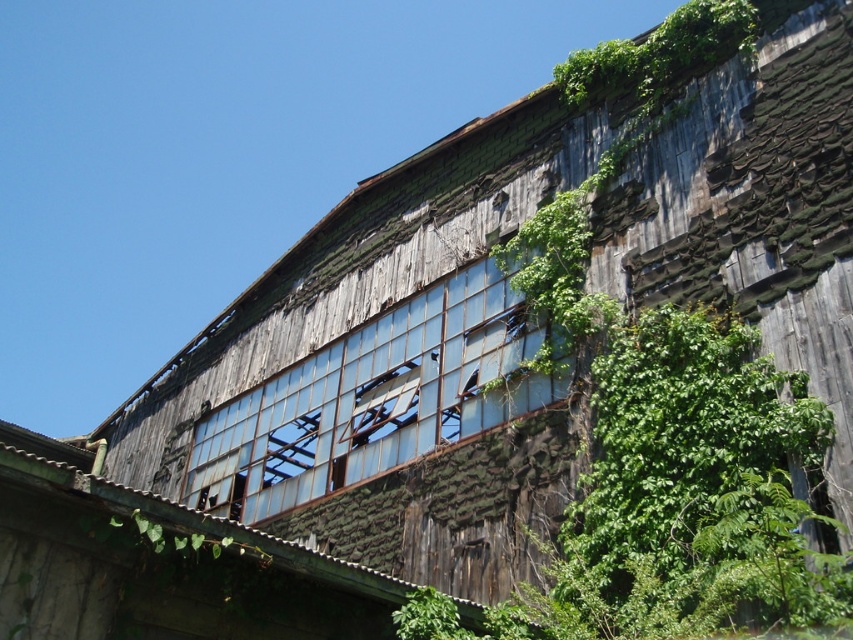
Which is above, transparent glass window at center or green leafy vines at upper right?

green leafy vines at upper right is higher up.

Does transparent glass window at center have a greater width compared to green leafy vines at upper right?

No.

Identify the location of transparent glass window at center. (373, 400).

In order to click on transparent glass window at center in this screenshot , I will do (x=373, y=400).